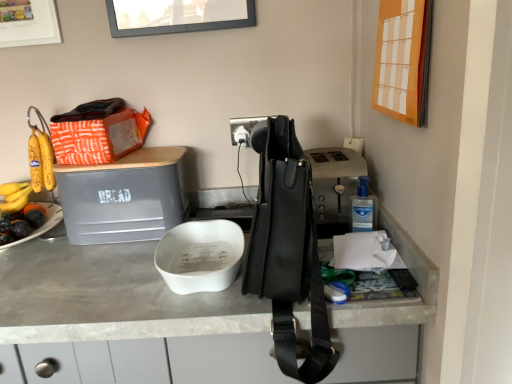
You are a GUI agent. You are given a task and a screenshot of the screen. Output one action in this format:
    pyautogui.click(x=<x>, y=<y>)
    Task: Click on the free space in front of gray matte bread bin at upper left
    The height and width of the screenshot is (384, 512).
    Given the screenshot: What is the action you would take?
    pyautogui.click(x=89, y=268)